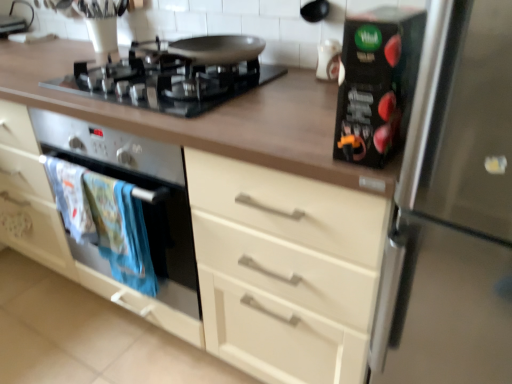
Locate an element on the screen. Image resolution: width=512 pixels, height=384 pixels. blank space above white fabric towels at lower left (from a real-world perspective) is located at coordinates (75, 166).